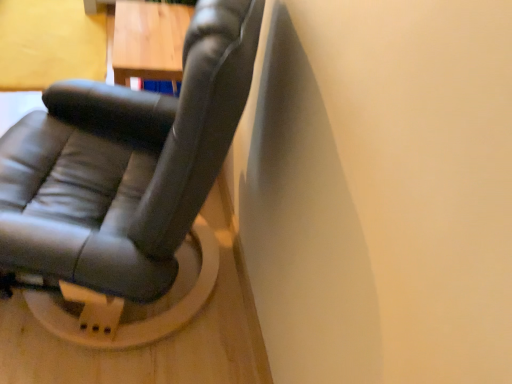
Question: Relative to matte black chair at center, is wooden table at upper left in front or behind?

Choices:
 (A) behind
 (B) front

Answer: (A)

Question: Is wooden table at upper left inside or outside of matte black chair at center?

Choices:
 (A) outside
 (B) inside

Answer: (A)

Question: Considering the positions of wooden table at upper left and matte black chair at center in the image, is wooden table at upper left taller or shorter than matte black chair at center?

Choices:
 (A) tall
 (B) short

Answer: (A)

Question: Considering the positions of point (92, 301) and point (150, 59), is point (92, 301) closer or farther from the camera than point (150, 59)?

Choices:
 (A) closer
 (B) farther

Answer: (A)

Question: Considering the positions of matte black chair at center and wooden table at upper left in the image, is matte black chair at center taller or shorter than wooden table at upper left?

Choices:
 (A) short
 (B) tall

Answer: (A)

Question: From the image's perspective, is matte black chair at center positioned above or below wooden table at upper left?

Choices:
 (A) below
 (B) above

Answer: (A)

Question: Would you say matte black chair at center is inside or outside wooden table at upper left?

Choices:
 (A) inside
 (B) outside

Answer: (B)